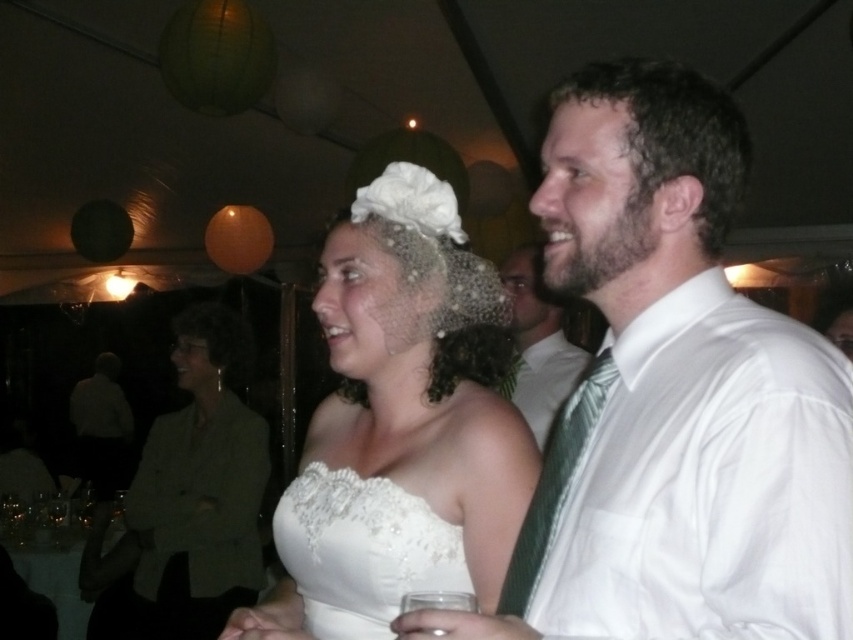
You are a photographer standing at the back of the reception area. You want to take a clear photo of the white satin dress at center. If your camera can focus on objects within 4 feet, will you be able to capture the dress clearly?

The white satin dress at center is 3.62 feet away from the viewer, which is within the camera focus range of 4 feet. Therefore, you can capture the dress clearly.

You are a photographer at the wedding reception and want to capture a photo that includes both the white lace dress at center and the green silk tie at right. Since you want both subjects to be in focus, which one should you focus on first to ensure depth of field?

The white lace dress at center is closer to you than the green silk tie at right, so you should focus on the white lace dress at center first to ensure both are in focus.

You are a photographer at the wedding reception. You need to capture a closeup shot of the white lace dress at center and the green silk tie at right. Since the camera has a limited focus range, which object should you prioritize to ensure it fits within the frame?

The white lace dress at center is wider than the green silk tie at right, so you should prioritize capturing the white lace dress at center to ensure it fits within the camera frame first.